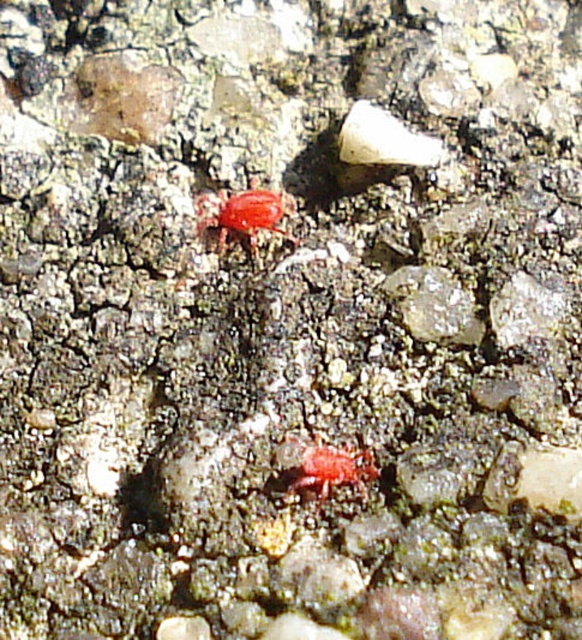
Who is positioned more to the left, shiny red bug at center or matte red insect at center?

Positioned to the left is shiny red bug at center.

Does shiny red bug at center appear over matte red insect at center?

Indeed, shiny red bug at center is positioned over matte red insect at center.

Does point (291, 205) come in front of point (368, 456)?

No, it is not.

I want to click on shiny red bug at center, so click(x=244, y=216).